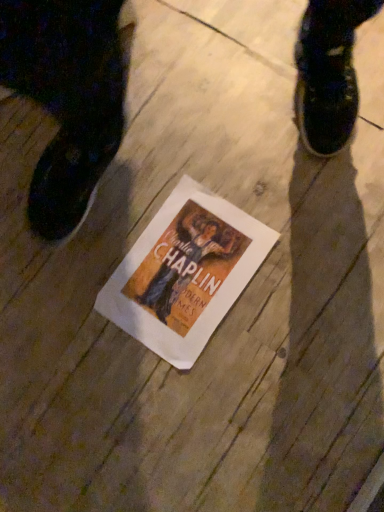
Where is `vacant space situated above matte paper poster at center (from a real-world perspective)`? vacant space situated above matte paper poster at center (from a real-world perspective) is located at coordinates pyautogui.click(x=185, y=270).